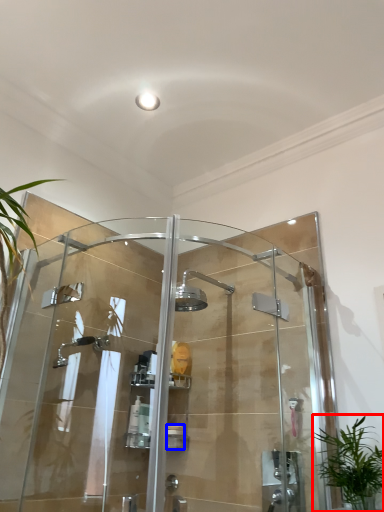
Question: Which of the following is the closest to the observer, houseplant (highlighted by a red box) or toiletry (highlighted by a blue box)?

Choices:
 (A) houseplant
 (B) toiletry

Answer: (A)